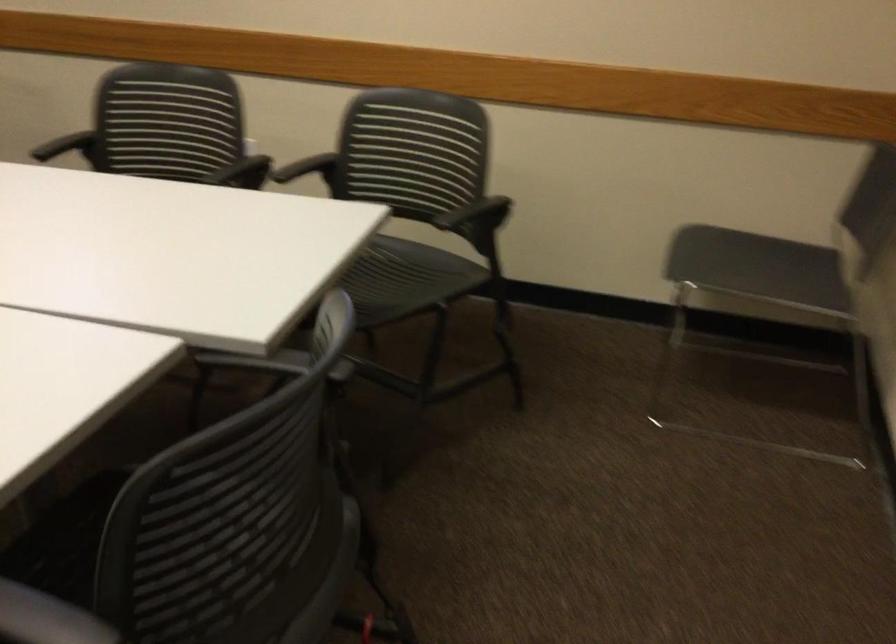
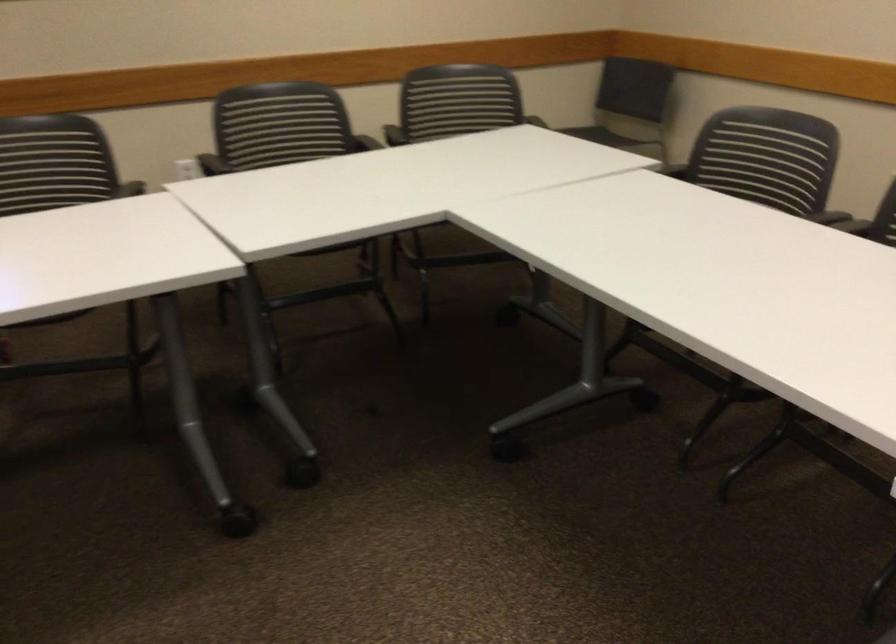
Locate, in the second image, the point that corresponds to (x=216, y=113) in the first image.

(280, 124)